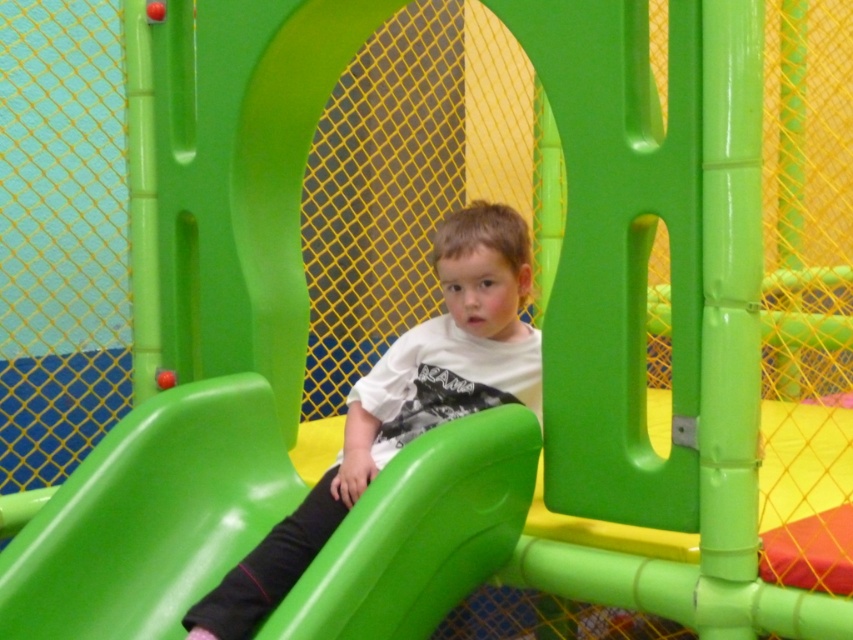
Identify the location of green glossy slide at center. Image resolution: width=853 pixels, height=640 pixels. (151, 516).

Is point (273, 476) closer to viewer compared to point (471, 371)?

That is False.

Is point (518, 504) closer to camera compared to point (283, 572)?

No.

At what (x,y) coordinates should I click in order to perform the action: click on green glossy slide at center. Please return your answer as a coordinate pair (x, y). The width and height of the screenshot is (853, 640). Looking at the image, I should click on (151, 516).